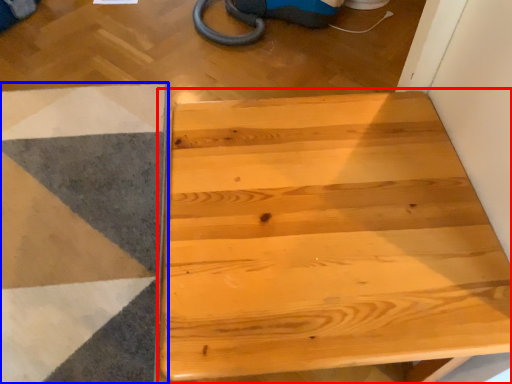
Question: Which of the following is the farthest to the observer, table (highlighted by a red box) or ramp (highlighted by a blue box)?

Choices:
 (A) table
 (B) ramp

Answer: (B)